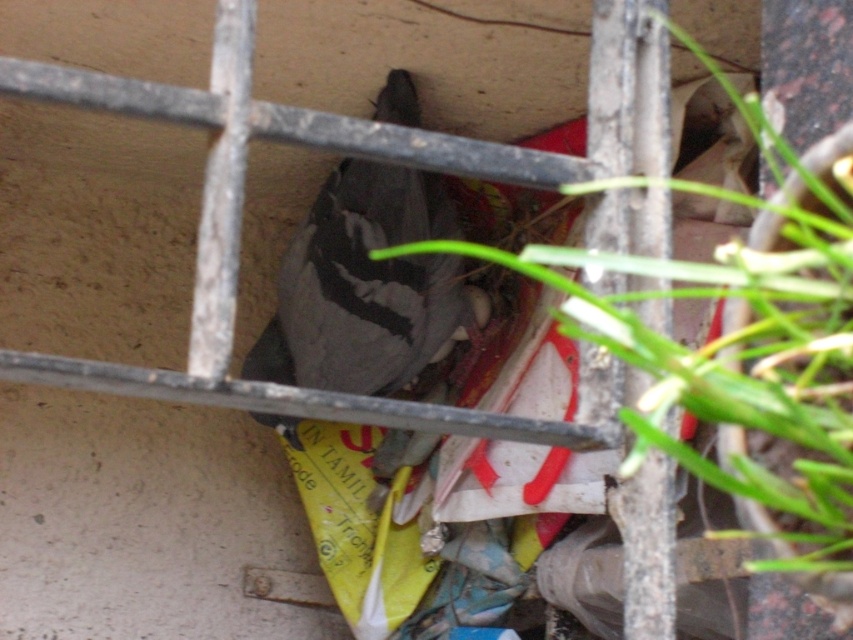
Does point (834, 177) come behind point (428, 173)?

No.

Who is more distant from viewer, (659,384) or (347,225)?

The point (347,225) is more distant.

Is point (637, 445) positioned behind point (396, 323)?

No, (637, 445) is in front of (396, 323).

Locate an element on the screen. Image resolution: width=853 pixels, height=640 pixels. green leafy plant at center is located at coordinates (741, 348).